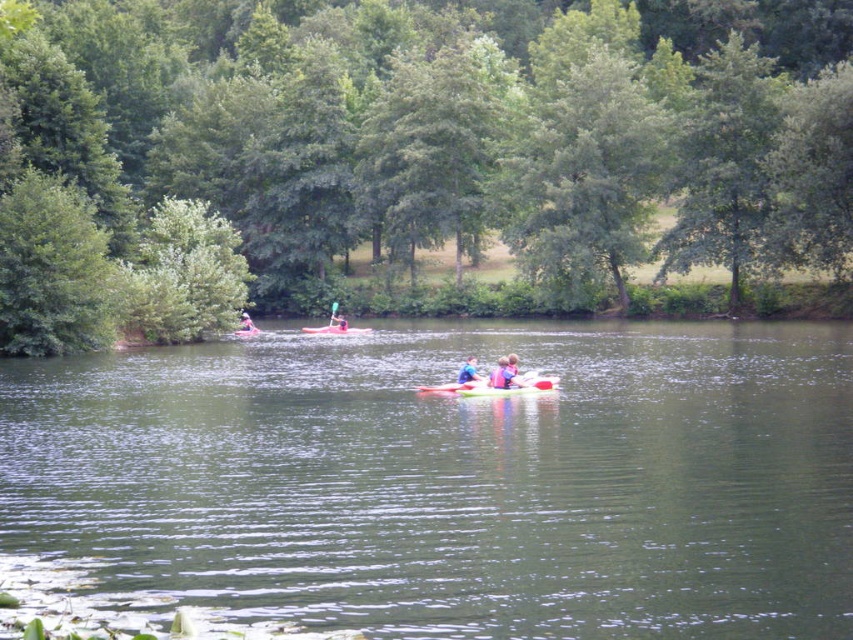
Which is in front, point (489, 378) or point (466, 371)?

Point (466, 371) is more forward.

Consider the image. Between blue fabric person at center and blue fabric kayak at center, which one has less height?

blue fabric kayak at center is shorter.

Locate an element on the screen. blue fabric person at center is located at coordinates (502, 374).

Can you confirm if green leafy tree at center is bigger than pink fabric kayak at center?

Yes, green leafy tree at center is bigger than pink fabric kayak at center.

How much distance is there between green leafy tree at center and pink fabric kayak at center?

A distance of 25.71 meters exists between green leafy tree at center and pink fabric kayak at center.

Is point (61, 294) positioned behind point (244, 330)?

No.

Where is `green leafy tree at center`? Image resolution: width=853 pixels, height=640 pixels. green leafy tree at center is located at coordinates (412, 148).

Does matte pink kayak at center appear on the right side of pink fabric kayak at center?

Indeed, matte pink kayak at center is positioned on the right side of pink fabric kayak at center.

Is point (329, 316) in front of point (248, 321)?

That is False.

The height and width of the screenshot is (640, 853). What are the coordinates of `matte pink kayak at center` in the screenshot? It's located at (338, 321).